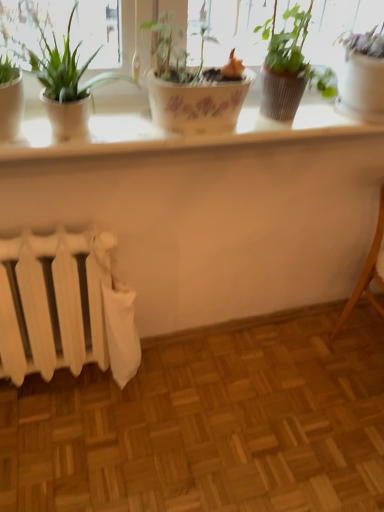
Locate an element on the screen. vacant space situated on the left part of light brown wooden chair at lower right is located at coordinates (309, 356).